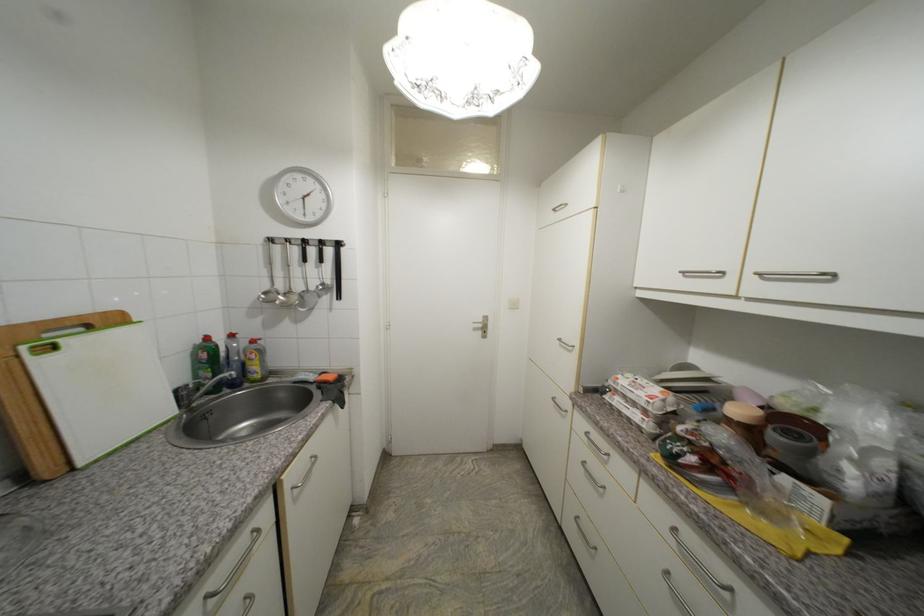
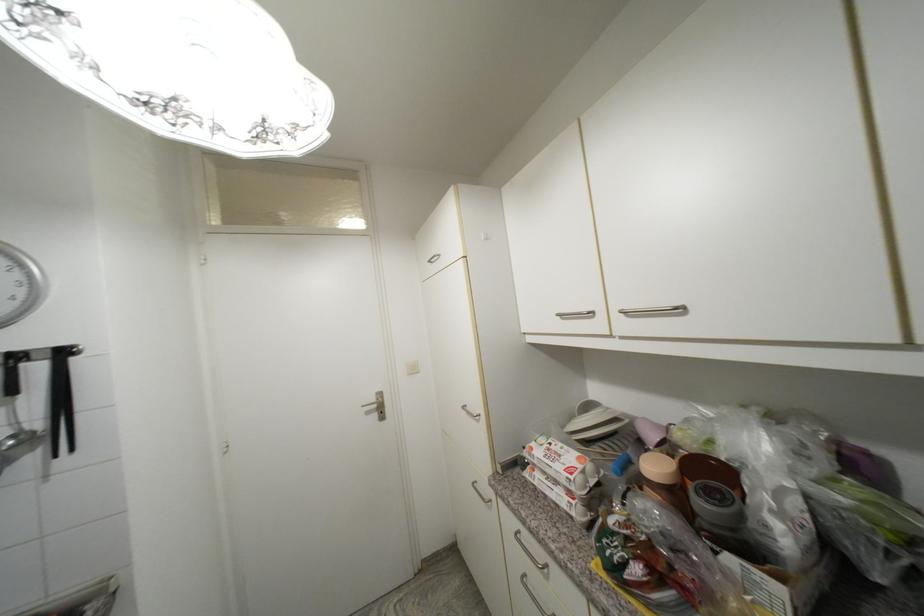
Where in the second image is the point corresponding to the point at 610,453 from the first image?

(546, 562)